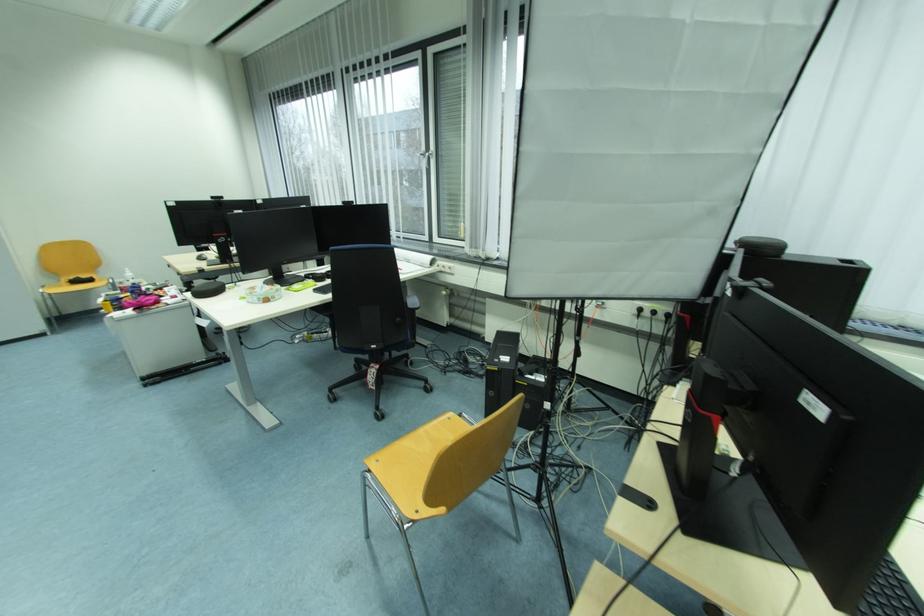
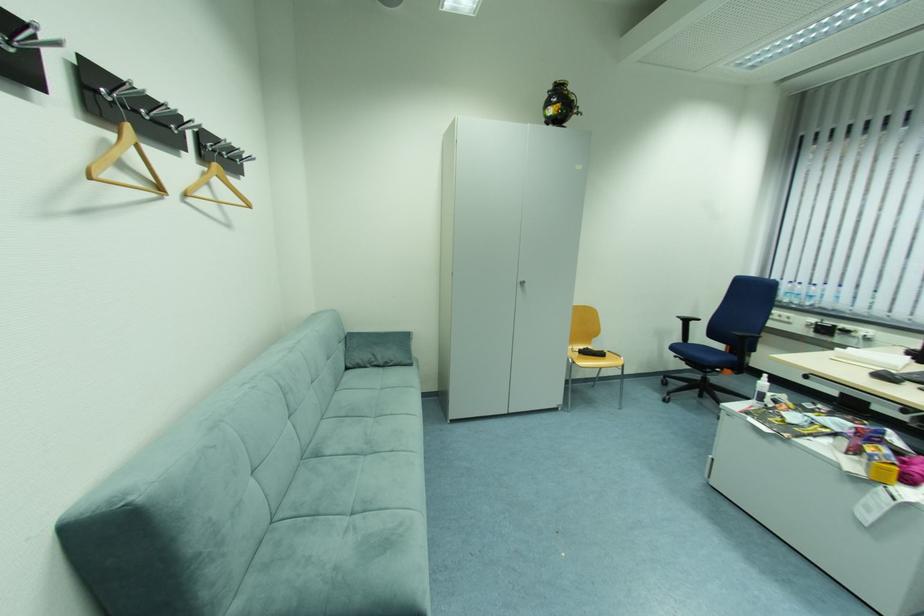
Locate, in the second image, the point that corresponds to (x=96, y=282) in the first image.

(608, 355)